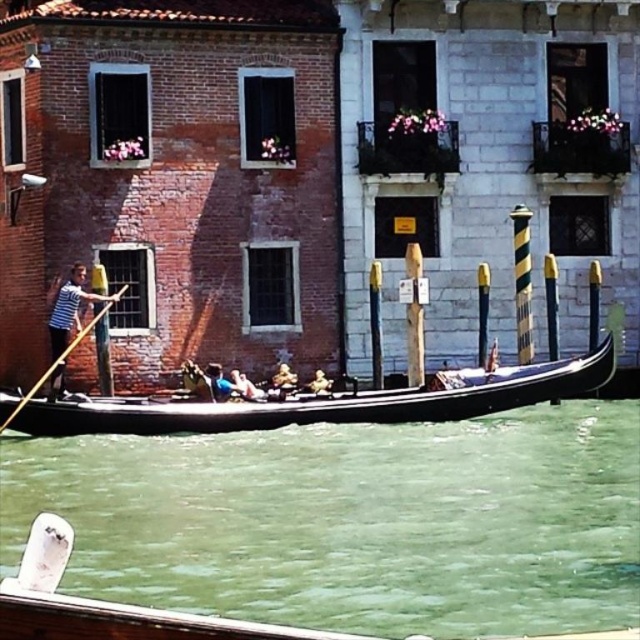
Who is shorter, black polished wood gondola at center or striped cotton shirt at left?

Standing shorter between the two is striped cotton shirt at left.

Does black polished wood gondola at center have a lesser width compared to striped cotton shirt at left?

No.

Identify the location of black polished wood gondola at center. (326, 403).

Does striped cotton shirt at left appear on the left side of smooth golden helmet at center?

Yes, striped cotton shirt at left is to the left of smooth golden helmet at center.

Which is behind, point (72, 289) or point (310, 384)?

Point (310, 384)

Image resolution: width=640 pixels, height=640 pixels. In order to click on striped cotton shirt at left in this screenshot , I will do `click(70, 308)`.

Can you confirm if black polished wood gondola at center is bigger than smooth golden helmet at center?

Indeed, black polished wood gondola at center has a larger size compared to smooth golden helmet at center.

Consider the image. Does black polished wood gondola at center appear on the right side of smooth golden helmet at center?

In fact, black polished wood gondola at center is to the left of smooth golden helmet at center.

Is point (588, 381) positioned in front of point (332, 381)?

Yes, it is in front of point (332, 381).

In order to click on black polished wood gondola at center in this screenshot , I will do pos(326,403).